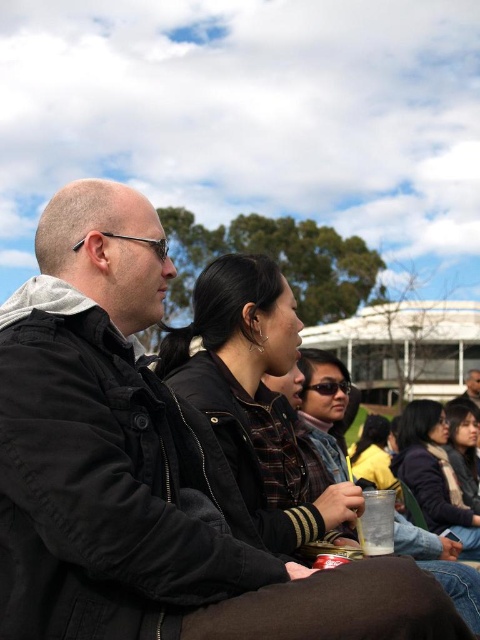
Question: Which is nearer to the black leather jacket at center?

Choices:
 (A) dark brown hair at lower right
 (B) matte black jacket at center
 (C) matte black jacket at lower right
 (D) black matte jacket at left

Answer: (D)

Question: Observing the image, what is the correct spatial positioning of black matte jacket at left in reference to black leather jacket at center?

Choices:
 (A) right
 (B) left

Answer: (B)

Question: Can you confirm if black matte jacket at left is positioned to the right of matte black jacket at lower right?

Choices:
 (A) yes
 (B) no

Answer: (B)

Question: Among these objects, which one is farthest from the camera?

Choices:
 (A) matte black jacket at lower right
 (B) black leather jacket at center
 (C) matte black jacket at center
 (D) dark brown hair at lower right

Answer: (A)

Question: Based on their relative distances, which object is farther from the black leather jacket at center?

Choices:
 (A) matte black jacket at center
 (B) matte black jacket at lower right
 (C) dark brown hair at lower right

Answer: (B)

Question: Does black leather jacket at center appear on the right side of dark brown hair at lower right?

Choices:
 (A) yes
 (B) no

Answer: (B)